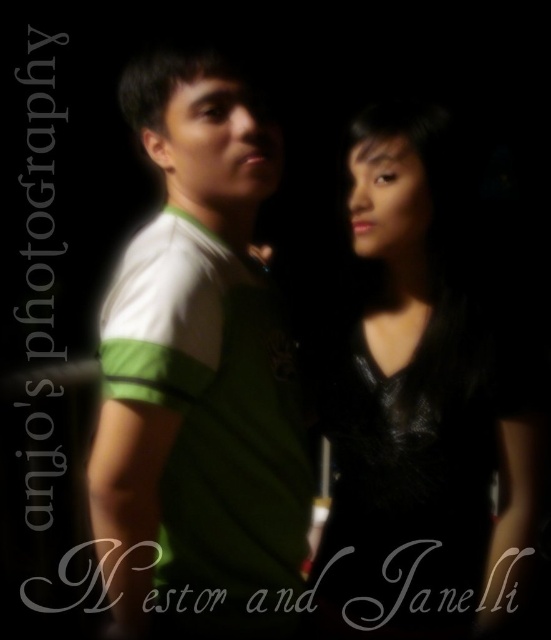
Question: Can you confirm if green jersey at center is wider than black leather dress at right?

Choices:
 (A) yes
 (B) no

Answer: (B)

Question: Does green jersey at center appear under black leather dress at right?

Choices:
 (A) yes
 (B) no

Answer: (B)

Question: Among these points, which one is farthest from the camera?

Choices:
 (A) (361, 486)
 (B) (277, 460)

Answer: (A)

Question: Among these points, which one is farthest from the camera?

Choices:
 (A) (180, 476)
 (B) (397, 211)

Answer: (B)

Question: Is green jersey at center wider than black leather dress at right?

Choices:
 (A) no
 (B) yes

Answer: (A)